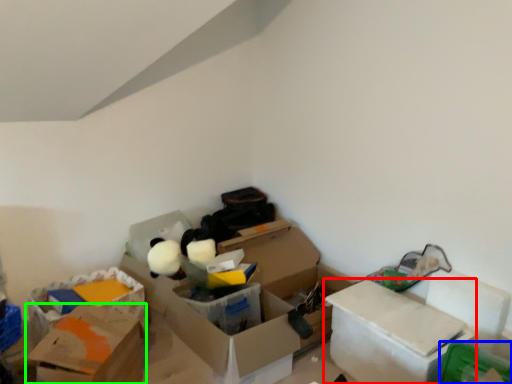
Question: Which object is the closest to the box (highlighted by a red box)? Choose among these: storage box (highlighted by a blue box) or box (highlighted by a green box).

Choices:
 (A) storage box
 (B) box

Answer: (A)